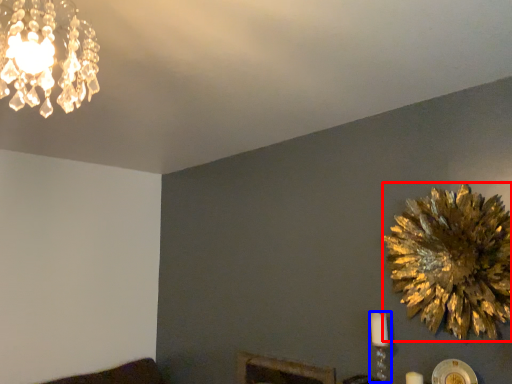
Question: Among these objects, which one is farthest to the camera, flower (highlighted by a red box) or candle holder (highlighted by a blue box)?

Choices:
 (A) flower
 (B) candle holder

Answer: (B)